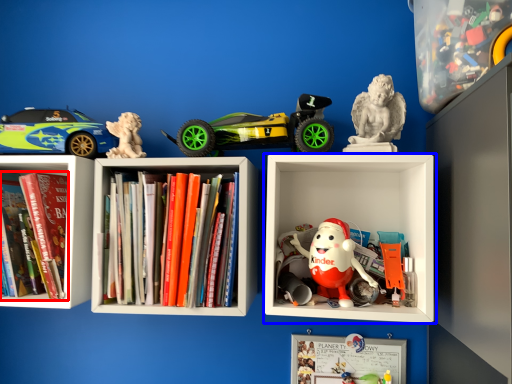
Question: Which object appears closest to the camera in this image, book (highlighted by a red box) or shelf (highlighted by a blue box)?

Choices:
 (A) book
 (B) shelf

Answer: (B)